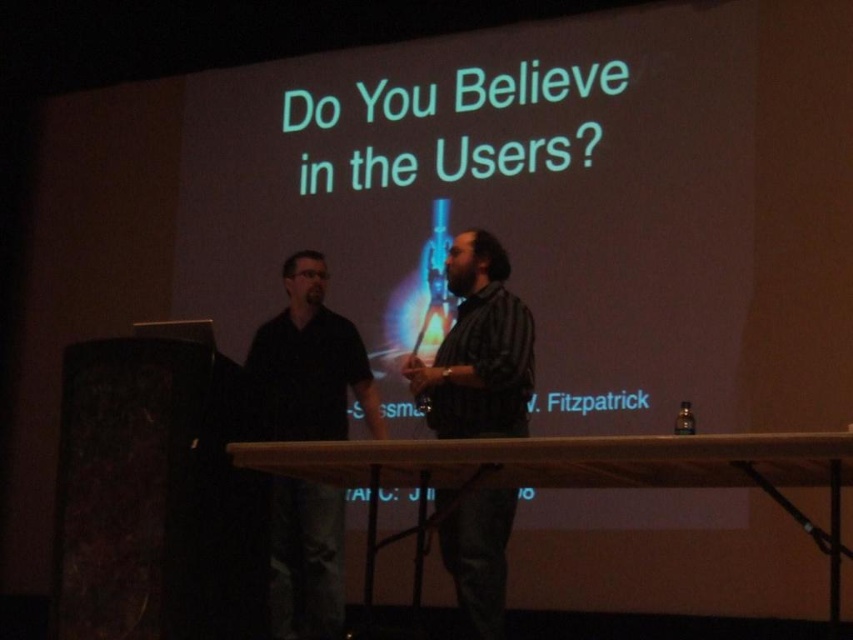
Question: Which object is positioned closest to the striped cotton shirt at center?

Choices:
 (A) white matte projection screen at upper center
 (B) black matte shirt at left

Answer: (B)

Question: Which object is the closest to the black matte shirt at left?

Choices:
 (A) striped cotton shirt at center
 (B) white matte projection screen at upper center

Answer: (A)

Question: Among these objects, which one is farthest from the camera?

Choices:
 (A) black matte shirt at left
 (B) white matte projection screen at upper center
 (C) striped cotton shirt at center

Answer: (A)

Question: Can you confirm if black matte shirt at left is positioned to the left of striped cotton shirt at center?

Choices:
 (A) no
 (B) yes

Answer: (B)

Question: From the image, what is the correct spatial relationship of black matte shirt at left in relation to striped cotton shirt at center?

Choices:
 (A) above
 (B) below

Answer: (B)

Question: Can you confirm if white matte projection screen at upper center is smaller than black matte shirt at left?

Choices:
 (A) no
 (B) yes

Answer: (A)